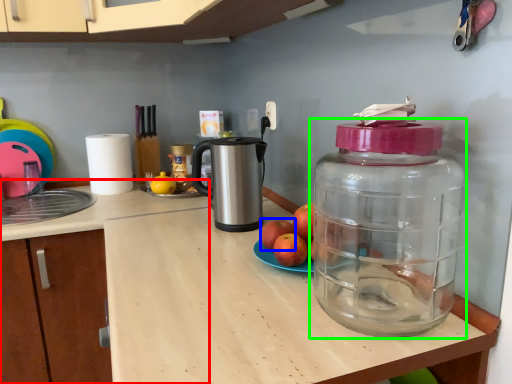
Question: Estimate the real-world distances between objects in this image. Which object is closer to counter top (highlighted by a red box), apple (highlighted by a blue box) or bottle (highlighted by a green box)?

Choices:
 (A) apple
 (B) bottle

Answer: (A)